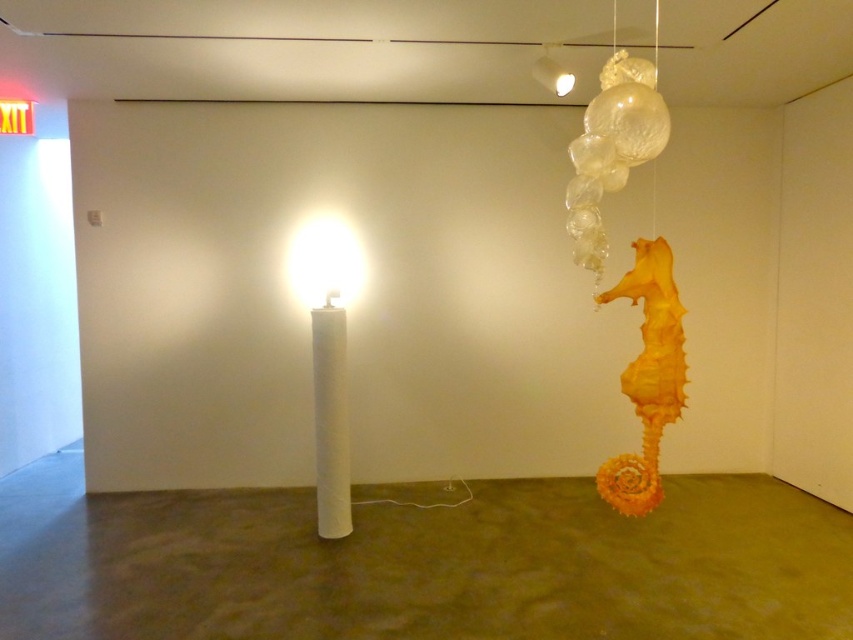
In the scene shown: You are an art curator standing 2 meters away from the white glossy cylinder at center. You want to move closer to it to inspect the light source mounted on top. Is the distance between you and the cylinder sufficient for you to reach it without needing to move further forward?

The white glossy cylinder at center is 3.63 meters from camera. Since you are already standing 2 meters away from it, you are closer than the stated distance, which suggests there might be a discrepancy. However, assuming the 3.63 meters is the actual distance, you would need to move forward approximately 1.63 meters to reach it.

You are an art curator planning to install a new exhibit. You have two cylinders, the white glossy cylinder at center and the white matte cylinder at center. According to the scene, which cylinder should be placed on top to maintain the existing installation structure?

The white glossy cylinder at center is located above the white matte cylinder at center, so to maintain the existing installation structure, the white glossy cylinder at center should be placed on top.